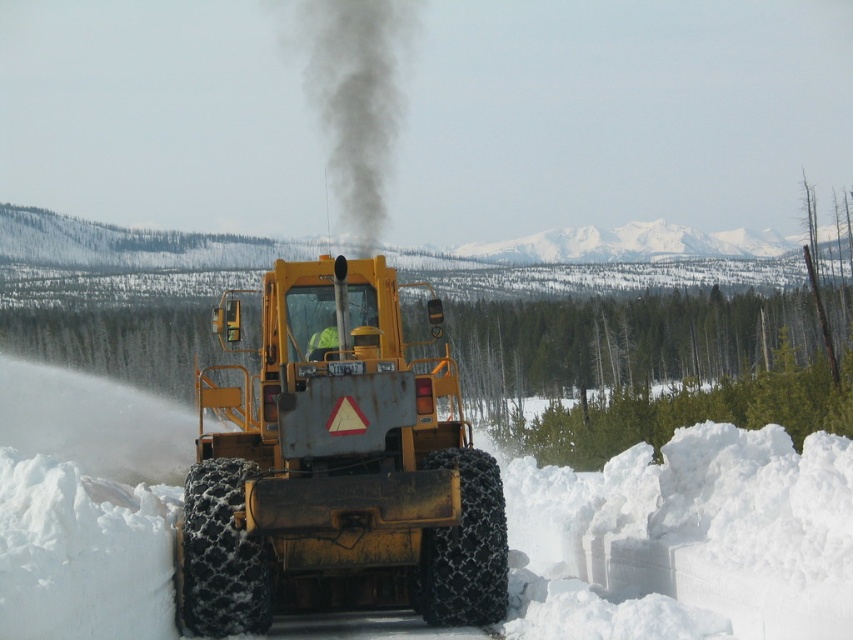
Question: Which object is the farthest from the black smoke at center?

Choices:
 (A) yellow metallic tractor at center
 (B) white powdery snow at center

Answer: (A)

Question: Does yellow metallic tractor at center appear on the left side of black smoke at center?

Choices:
 (A) no
 (B) yes

Answer: (A)

Question: Which of these objects is positioned closest to the yellow metallic tractor at center?

Choices:
 (A) black smoke at center
 (B) white powdery snow at center

Answer: (B)

Question: Which object appears farthest from the camera in this image?

Choices:
 (A) yellow metallic tractor at center
 (B) white powdery snow at center

Answer: (A)

Question: Is yellow metallic tractor at center above black smoke at center?

Choices:
 (A) no
 (B) yes

Answer: (A)

Question: In this image, where is white powdery snow at center located relative to black smoke at center?

Choices:
 (A) left
 (B) right

Answer: (B)